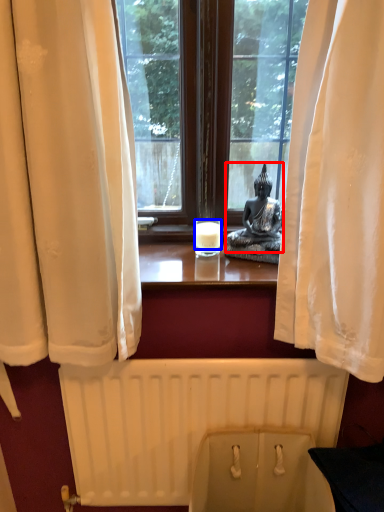
Question: Which point is further to the camera, person (highlighted by a red box) or candle (highlighted by a blue box)?

Choices:
 (A) person
 (B) candle

Answer: (B)